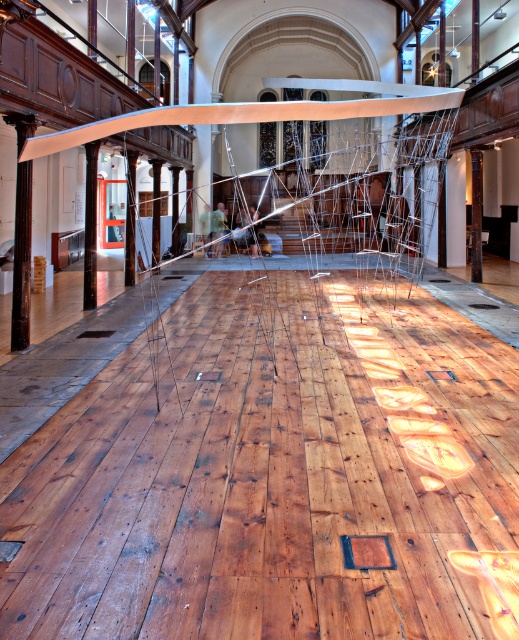
What do you see at coordinates (261, 109) in the screenshot? This screenshot has width=519, height=640. I see `metallic wire at center` at bounding box center [261, 109].

Is metallic wire at center above white metallic beam at upper center?

Indeed, metallic wire at center is positioned over white metallic beam at upper center.

Which is in front, point (330, 81) or point (217, 106)?

Point (217, 106)

This screenshot has width=519, height=640. In order to click on metallic wire at center in this screenshot , I will do `click(261, 109)`.